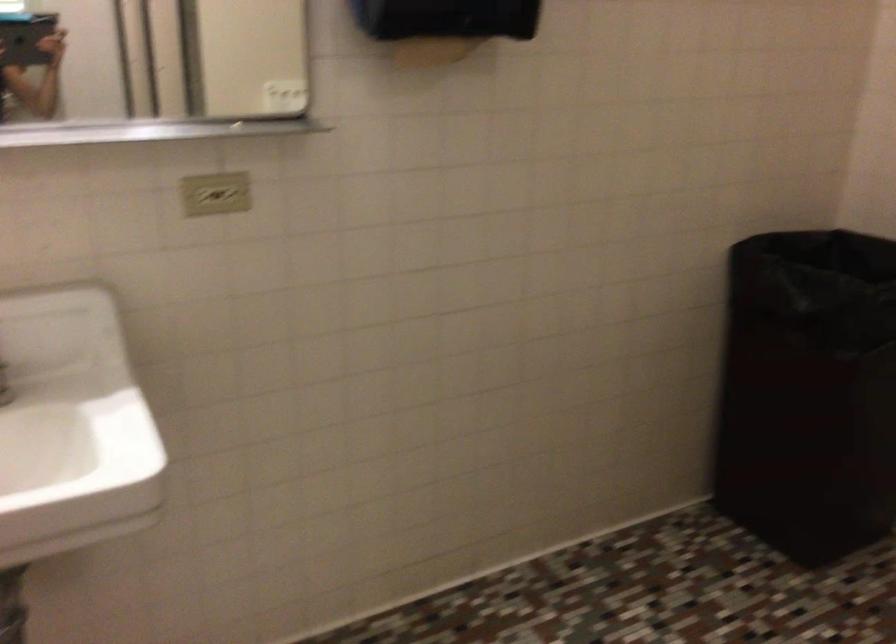
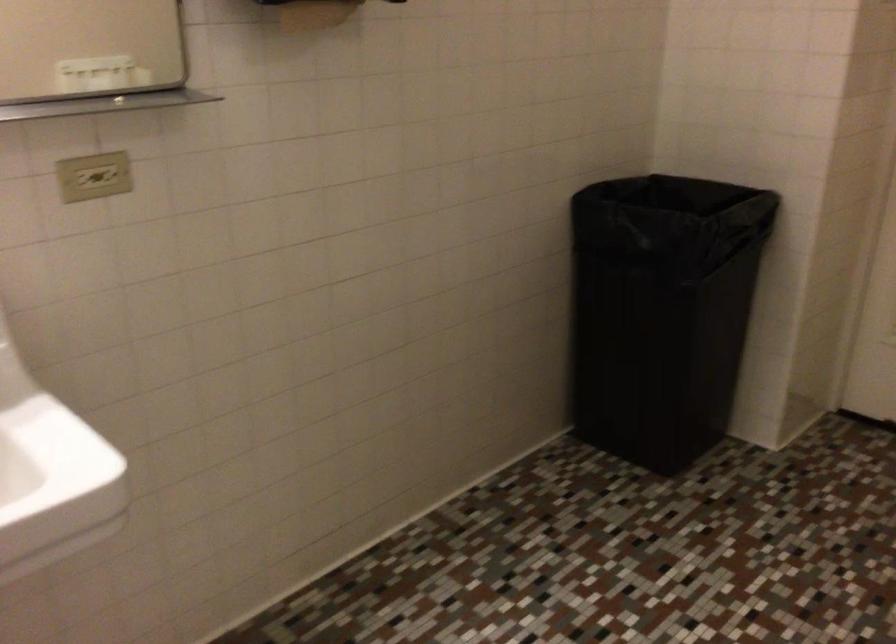
Question: The images are taken continuously from a first-person perspective. In which direction is your viewpoint rotating?

Choices:
 (A) Left
 (B) Right
 (C) Up
 (D) Down

Answer: (B)